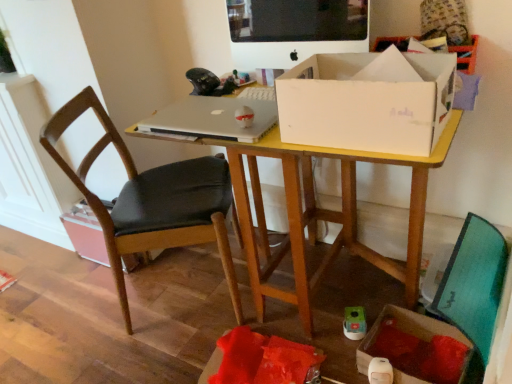
The image size is (512, 384). I want to click on blank space to the left of black leather chair at left, so coord(76,320).